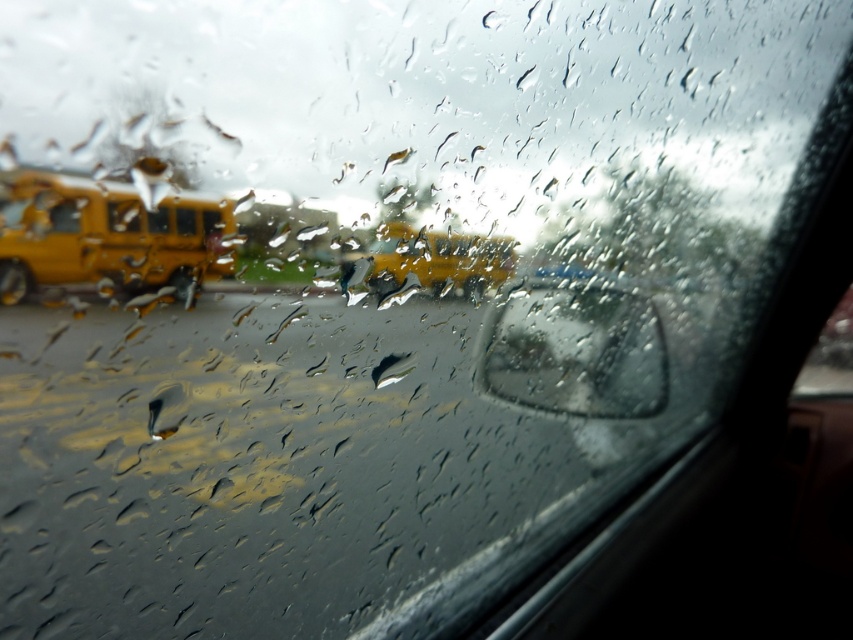
Looking at this image, you are a passenger in the vehicle and notice two yellow buses outside through the rain streaked window. Which of the two buses, the matte yellow school bus at left or the yellow matte bus at left, is closer to the vehicle based on their positions?

The matte yellow school bus at left is positioned under the yellow matte bus at left, meaning it is closer to the vehicle since it is lower in the image.

You are inside the vehicle and want to check the rearview mirror to see if the two yellow school buses are visible. However, you notice a point at coordinates (576, 349) that might be obstructing your view. What object is located at that point?

The transparent glass mirror at center is located at point (576, 349).

You are inside a car and want to check the rearview mirror to see if the yellow matte bus at left is taller than the transparent glass mirror at center. Based on the scene, what can you conclude?

The transparent glass mirror at center is taller than the yellow matte bus at left, so the yellow matte bus at left is shorter than the transparent glass mirror at center.